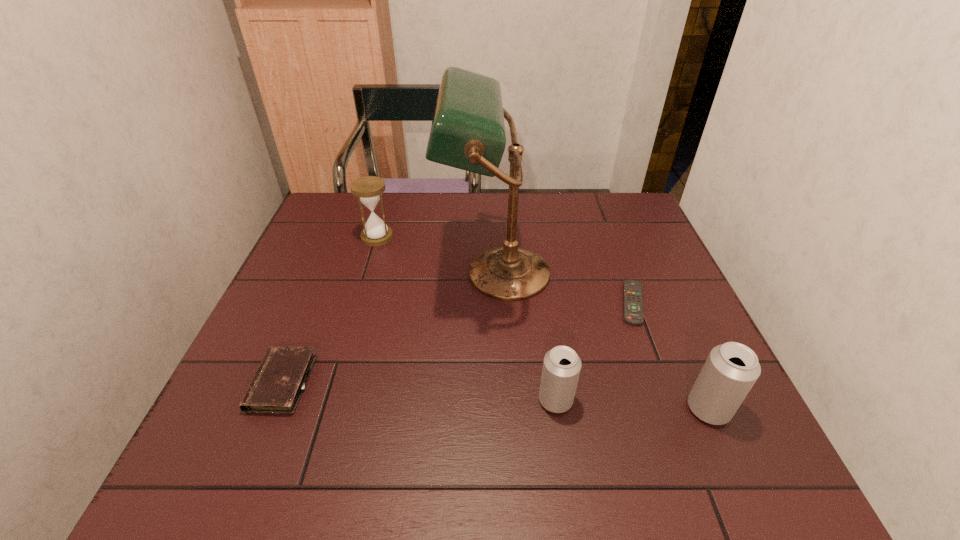
Locate an element on the screen. the shorter beer can is located at coordinates (561, 368).

Where is `the third shortest object`? This screenshot has height=540, width=960. the third shortest object is located at coordinates click(x=561, y=368).

Locate an element on the screen. the right beer can is located at coordinates (731, 369).

Locate an element on the screen. The height and width of the screenshot is (540, 960). the tallest object is located at coordinates (468, 130).

At what (x,y) coordinates should I click in order to perform the action: click on hourglass. Please return your answer as a coordinate pair (x, y). Looking at the image, I should click on (368, 189).

At what (x,y) coordinates should I click in order to perform the action: click on the fifth tallest object. Please return your answer as a coordinate pair (x, y). The width and height of the screenshot is (960, 540). Looking at the image, I should click on (278, 383).

This screenshot has width=960, height=540. Identify the location of the leftmost object. (278, 383).

What are the coordinates of `the shortest object` in the screenshot? It's located at (633, 299).

Identify the location of vacant space located 0.080m on the right of the left beer can. The height and width of the screenshot is (540, 960). (612, 400).

Image resolution: width=960 pixels, height=540 pixels. Identify the location of vacant space positioned on the back of the right beer can. (647, 269).